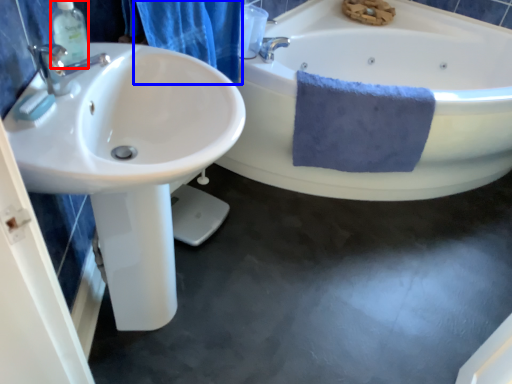
Question: Which of the following is the farthest to the observer, soap dispenser (highlighted by a red box) or shower curtain (highlighted by a blue box)?

Choices:
 (A) soap dispenser
 (B) shower curtain

Answer: (B)